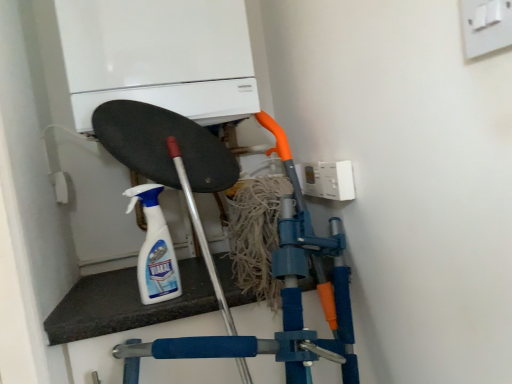
Question: Is white plastic spray bottle at center next to white plastic switch at upper right, marked as the 2th electric outlet in a back-to-front arrangement?

Choices:
 (A) no
 (B) yes

Answer: (A)

Question: Is white plastic spray bottle at center bigger than white plastic switch at upper right, the first electric outlet positioned from the front?

Choices:
 (A) yes
 (B) no

Answer: (A)

Question: Would you say white plastic switch at upper right, the first electric outlet in the right-to-left sequence, is part of white plastic spray bottle at center's contents?

Choices:
 (A) no
 (B) yes

Answer: (A)

Question: From a real-world perspective, is white plastic spray bottle at center positioned under white plastic switch at upper right, marked as the 2th electric outlet in a back-to-front arrangement, based on gravity?

Choices:
 (A) no
 (B) yes

Answer: (B)

Question: Considering the relative positions of white plastic spray bottle at center and white plastic switch at upper right, marked as the second electric outlet in a bottom-to-top arrangement, in the image provided, is white plastic spray bottle at center to the left of white plastic switch at upper right, marked as the second electric outlet in a bottom-to-top arrangement, from the viewer's perspective?

Choices:
 (A) yes
 (B) no

Answer: (A)

Question: Is the depth of white plastic spray bottle at center greater than that of white plastic switch at upper right, marked as the 2th electric outlet in a back-to-front arrangement?

Choices:
 (A) no
 (B) yes

Answer: (B)

Question: Is white matte boiler at upper center at the right side of white plastic electric outlet at upper right, arranged as the 1th electric outlet when viewed from the left?

Choices:
 (A) yes
 (B) no

Answer: (B)

Question: Is white plastic electric outlet at upper right, which is the second electric outlet in front-to-back order, surrounded by white matte boiler at upper center?

Choices:
 (A) yes
 (B) no

Answer: (B)

Question: Is white matte boiler at upper center facing away from white plastic electric outlet at upper right, which appears as the first electric outlet when ordered from the bottom?

Choices:
 (A) yes
 (B) no

Answer: (B)

Question: Is white matte boiler at upper center located outside white plastic electric outlet at upper right, which appears as the first electric outlet when ordered from the bottom?

Choices:
 (A) yes
 (B) no

Answer: (A)

Question: From the image's perspective, does white matte boiler at upper center appear lower than white plastic electric outlet at upper right, the 2th electric outlet from the right?

Choices:
 (A) no
 (B) yes

Answer: (A)

Question: Is white matte boiler at upper center aimed at white plastic electric outlet at upper right, the 2th electric outlet from the right?

Choices:
 (A) no
 (B) yes

Answer: (A)

Question: Considering the relative sizes of white matte boiler at upper center and white plastic spray bottle at center in the image provided, is white matte boiler at upper center wider than white plastic spray bottle at center?

Choices:
 (A) yes
 (B) no

Answer: (A)